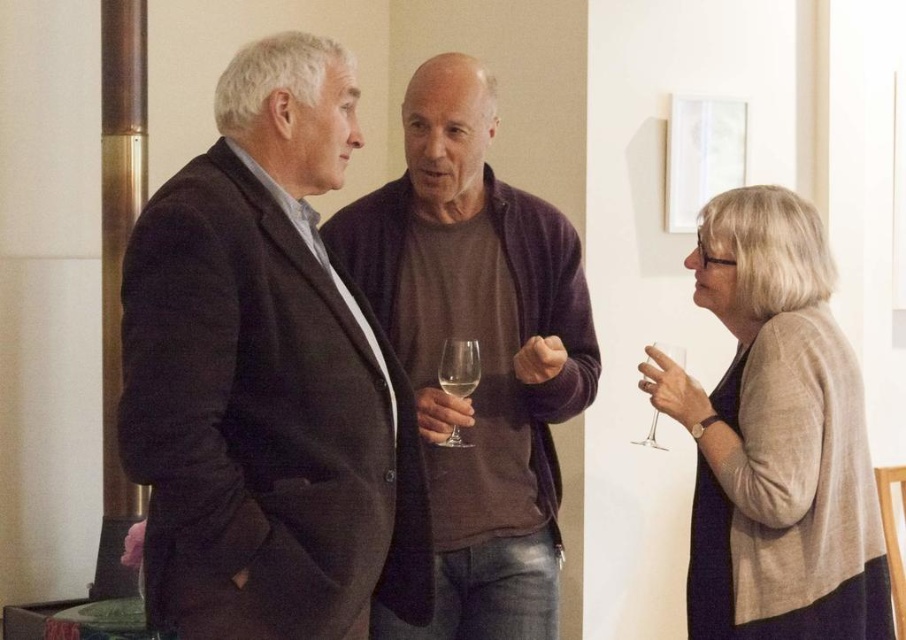
Does dark brown suit at center appear under clear glass at center?

No.

Does point (389, 557) lie in front of point (477, 381)?

Yes, it is in front of point (477, 381).

The width and height of the screenshot is (906, 640). Find the location of `dark brown suit at center`. dark brown suit at center is located at coordinates (266, 380).

Is the position of dark brown suit at center more distant than that of clear glass wine glass at lower right?

No.

Which is above, dark brown suit at center or clear glass wine glass at lower right?

dark brown suit at center is above.

The height and width of the screenshot is (640, 906). Describe the element at coordinates (266, 380) in the screenshot. I see `dark brown suit at center` at that location.

You are a GUI agent. You are given a task and a screenshot of the screen. Output one action in this format:
    pyautogui.click(x=<x>, y=<y>)
    Task: Click on the dark brown suit at center
    Image resolution: width=906 pixels, height=640 pixels.
    Given the screenshot: What is the action you would take?
    pyautogui.click(x=266, y=380)

Is dark brown suit at center behind brown cotton sweater at center?

No, dark brown suit at center is closer to the viewer.

Describe the element at coordinates (266, 380) in the screenshot. I see `dark brown suit at center` at that location.

Where is `dark brown suit at center`? Image resolution: width=906 pixels, height=640 pixels. dark brown suit at center is located at coordinates (266, 380).